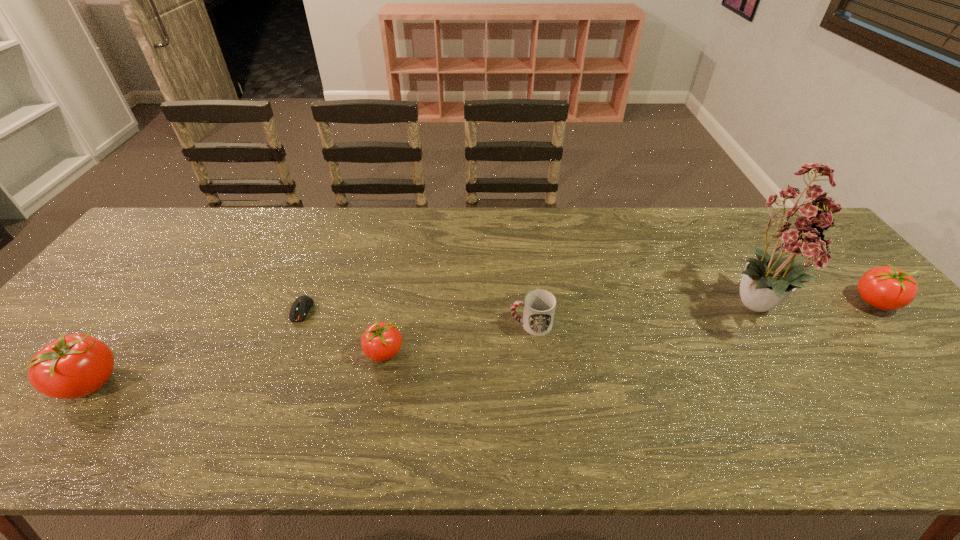
If equal spacing is desired by inserting an extra tomato among them, please point out a free spot for this new tomato. Please provide its 2D coordinates. Your answer should be formatted as a tuple, i.e. [(x, y)], where the tuple contains the x and y coordinates of a point satisfying the conditions above.

[(642, 326)]